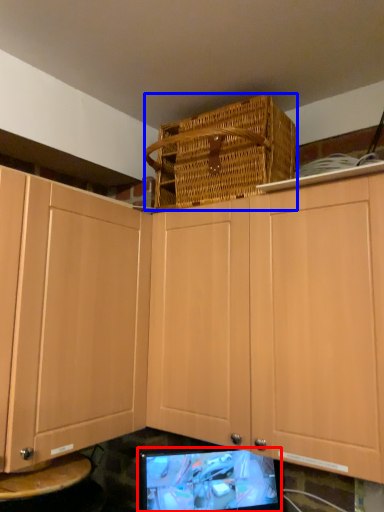
Question: Among these objects, which one is farthest to the camera, computer monitor (highlighted by a red box) or basket (highlighted by a blue box)?

Choices:
 (A) computer monitor
 (B) basket

Answer: (A)